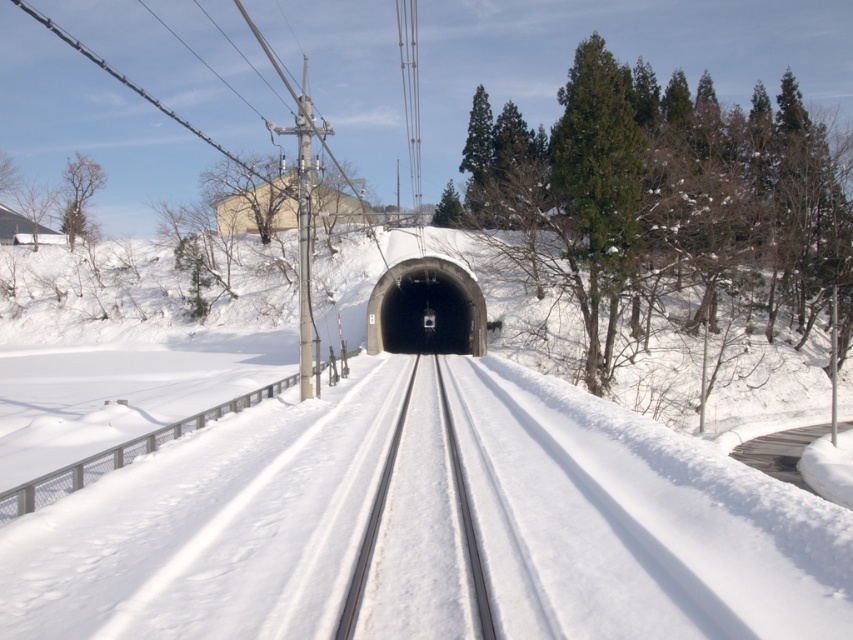
Which is in front, point (448, 321) or point (410, 106)?

Point (448, 321) is more forward.

Is black concrete tunnel at center thinner than metallic wires at center?

Correct, black concrete tunnel at center's width is less than metallic wires at center's.

Does point (465, 278) come behind point (410, 128)?

No, (465, 278) is in front of (410, 128).

You are a GUI agent. You are given a task and a screenshot of the screen. Output one action in this format:
    pyautogui.click(x=<x>, y=<y>)
    Task: Click on the black concrete tunnel at center
    The height and width of the screenshot is (640, 853).
    Given the screenshot: What is the action you would take?
    pyautogui.click(x=426, y=308)

Can you confirm if black concrete tunnel at center is shorter than smooth steel tracks at center?

In fact, black concrete tunnel at center may be taller than smooth steel tracks at center.

What are the coordinates of `black concrete tunnel at center` in the screenshot? It's located at (426, 308).

The image size is (853, 640). What are the coordinates of `black concrete tunnel at center` in the screenshot? It's located at (426, 308).

In order to click on black concrete tunnel at center in this screenshot , I will do `click(426, 308)`.

In the scene shown: Is smooth steel tracks at center smaller than metallic wires at center?

Correct, smooth steel tracks at center occupies less space than metallic wires at center.

Which is in front, point (351, 600) or point (418, 188)?

Point (351, 600)

Find the location of a particular element. Image resolution: width=853 pixels, height=640 pixels. smooth steel tracks at center is located at coordinates (370, 525).